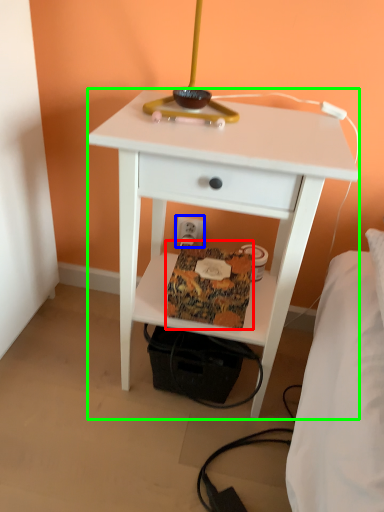
Question: Considering the real-world distances, which object is closest to package (highlighted by a red box)? electric outlet (highlighted by a blue box) or nightstand (highlighted by a green box).

Choices:
 (A) electric outlet
 (B) nightstand

Answer: (B)